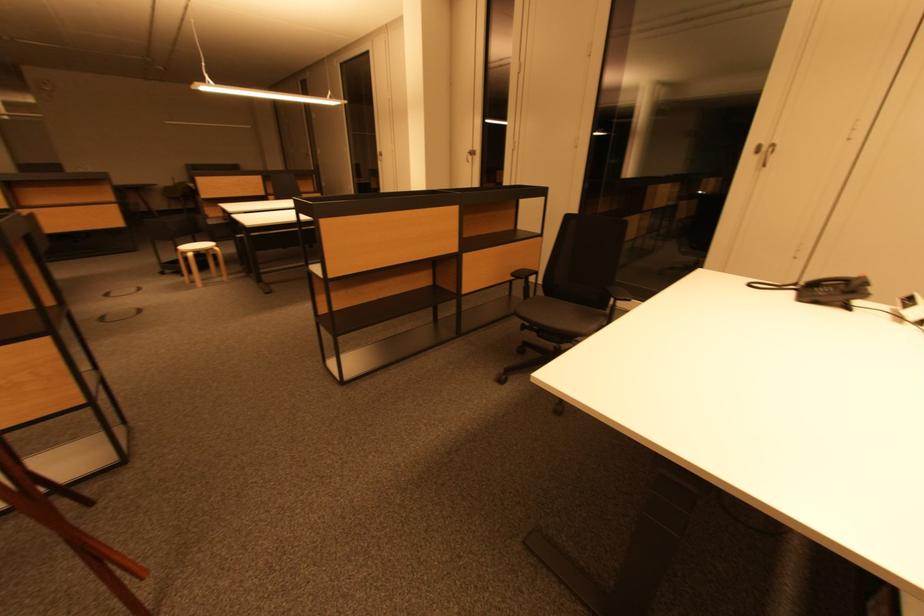
Find where to lift the black telephone handset. Please return your answer as a coordinate pair (x, y).

(825, 281)